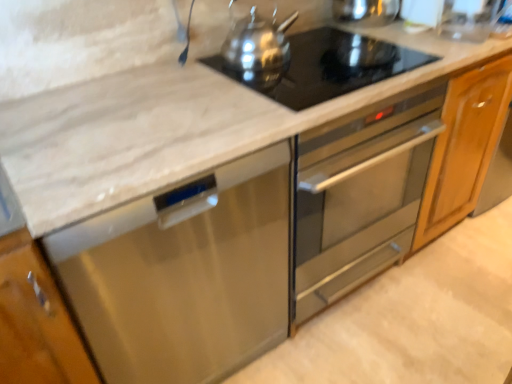
Question: Considering their positions, is polished stainless steel kettle at upper center located in front of or behind black glass cooktop at upper center?

Choices:
 (A) behind
 (B) front

Answer: (A)

Question: From a real-world perspective, is polished stainless steel kettle at upper center above or below black glass cooktop at upper center?

Choices:
 (A) below
 (B) above

Answer: (B)

Question: Considering the real-world distances, which object is closest to the polished stainless steel kettle at upper center?

Choices:
 (A) white marble cabinet at lower left
 (B) stainless steel dishwasher at lower left
 (C) black glass cooktop at upper center

Answer: (C)

Question: Which object is positioned farthest from the black glass cooktop at upper center?

Choices:
 (A) white marble cabinet at lower left
 (B) polished stainless steel kettle at upper center
 (C) stainless steel dishwasher at lower left

Answer: (A)